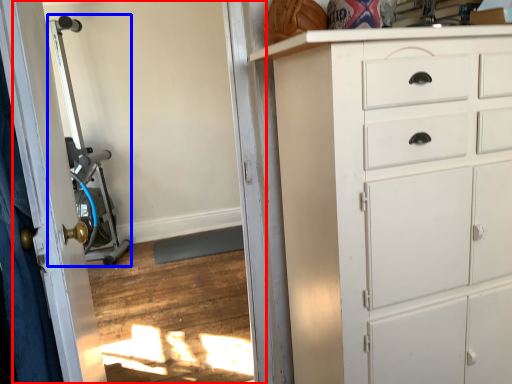
Question: Which object is closer to the camera taking this photo, screen door (highlighted by a red box) or sport equipment (highlighted by a blue box)?

Choices:
 (A) screen door
 (B) sport equipment

Answer: (A)